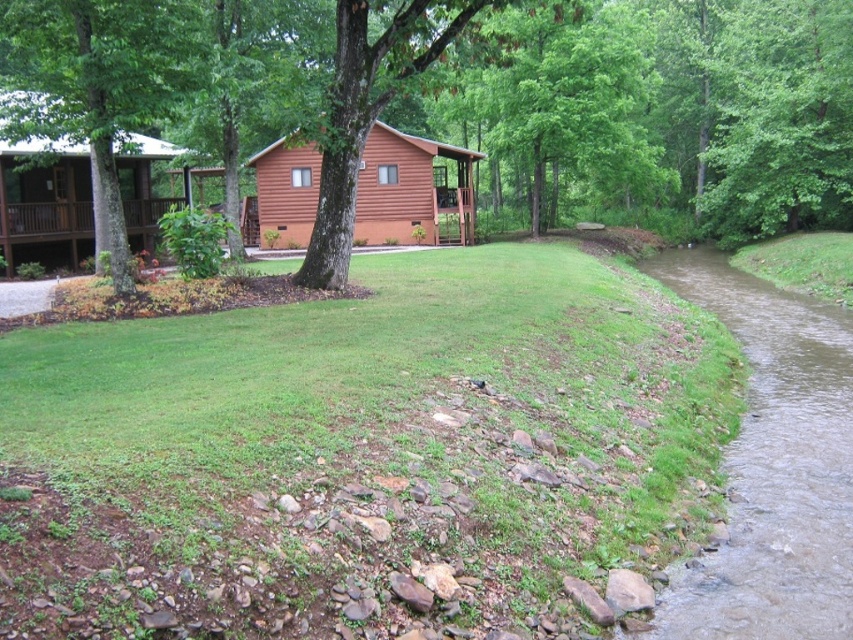
Is brown muddy water at lower right positioned at the back of brown wooden cabin at upper left?

No, brown muddy water at lower right is in front of brown wooden cabin at upper left.

Does brown muddy water at lower right have a larger size compared to brown wooden cabin at upper left?

No.

Identify the location of brown muddy water at lower right. (772, 467).

Which of these two, green leafy tree at center or brown muddy water at lower right, stands shorter?

With less height is brown muddy water at lower right.

The height and width of the screenshot is (640, 853). Describe the element at coordinates (491, 90) in the screenshot. I see `green leafy tree at center` at that location.

This screenshot has height=640, width=853. What are the coordinates of `green leafy tree at center` in the screenshot? It's located at (491, 90).

Who is positioned more to the right, green leafy tree at center or brown wooden cabin at upper left?

green leafy tree at center is more to the right.

Locate an element on the screen. Image resolution: width=853 pixels, height=640 pixels. green leafy tree at center is located at coordinates (491, 90).